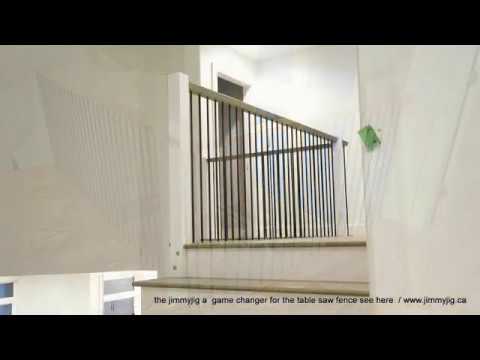
In order to click on the top step of staircase in this screenshot , I will do `click(262, 286)`.